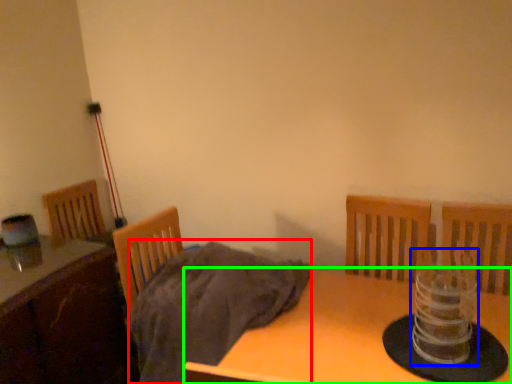
Question: Estimate the real-world distances between objects in this image. Which object is closer to blanket (highlighted by a red box), candle holder (highlighted by a blue box) or table (highlighted by a green box)?

Choices:
 (A) candle holder
 (B) table

Answer: (B)